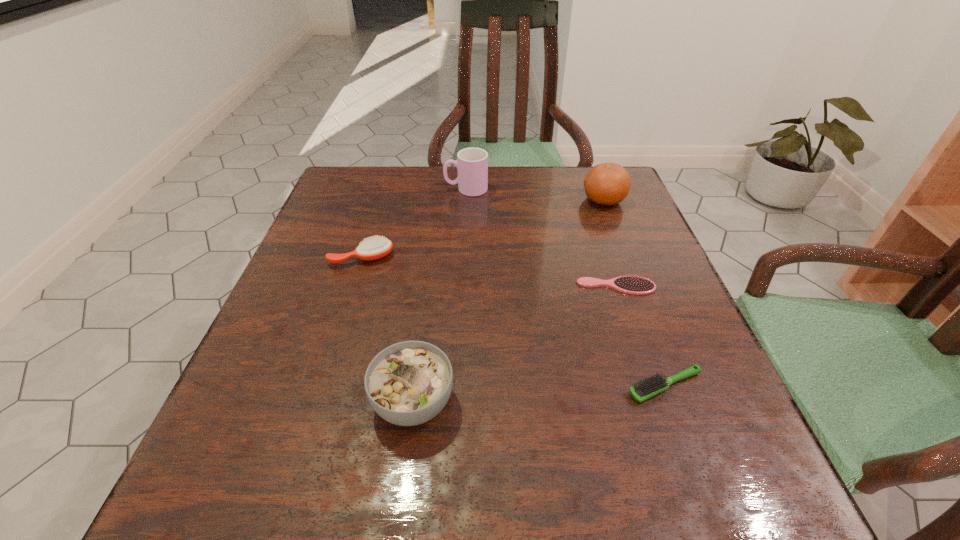
This screenshot has height=540, width=960. I want to click on cup, so click(472, 163).

The width and height of the screenshot is (960, 540). Find the location of `clementine`. clementine is located at coordinates (608, 183).

Identify the location of soup bowl. pyautogui.click(x=408, y=383).

The height and width of the screenshot is (540, 960). Find the location of `the tallest hairbrush`. the tallest hairbrush is located at coordinates (375, 248).

I want to click on the farthest hairbrush, so click(375, 248).

Locate an element on the screen. the second tallest hairbrush is located at coordinates (654, 385).

Locate an element on the screen. the fifth tallest object is located at coordinates (654, 385).

You are a GUI agent. You are given a task and a screenshot of the screen. Output one action in this format:
    pyautogui.click(x=<x>, y=<y>)
    Task: Click on the shortest hairbrush
    
    Given the screenshot: What is the action you would take?
    pyautogui.click(x=634, y=285)

In order to click on the second nearest hairbrush in this screenshot , I will do `click(634, 285)`.

Identify the location of vacant position located 0.240m with the handle on the side of the cup. (351, 189).